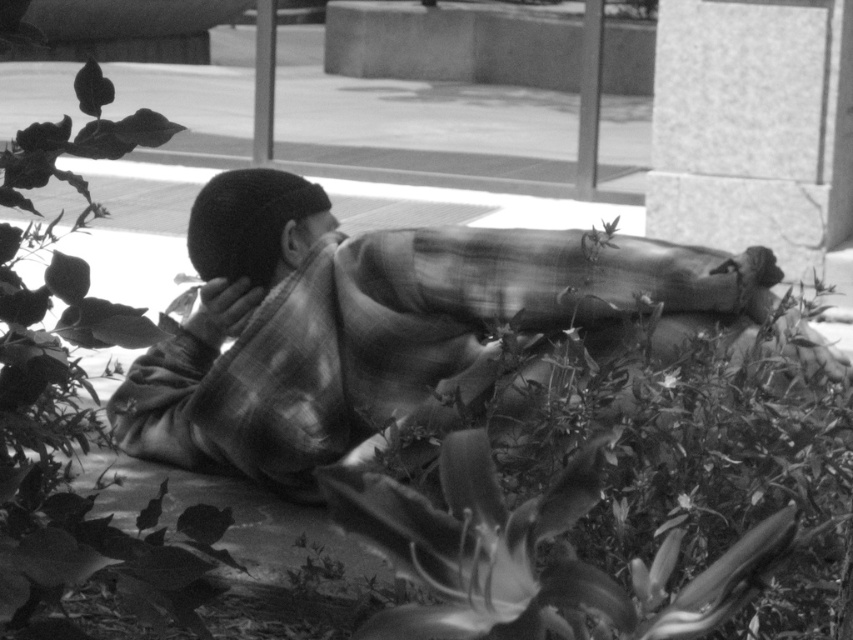
Question: Which point is farther to the camera?

Choices:
 (A) green leafy plant at center
 (B) plaid fabric at center

Answer: (B)

Question: Which point appears farthest from the camera in this image?

Choices:
 (A) (486, 452)
 (B) (292, 244)

Answer: (B)

Question: Among these points, which one is farthest from the camera?

Choices:
 (A) (332, 220)
 (B) (260, 365)
 (C) (404, 524)

Answer: (A)

Question: Is green leafy plant at center smaller than smooth skin face at center?

Choices:
 (A) no
 (B) yes

Answer: (A)

Question: Does green leafy plant at center appear on the left side of smooth skin face at center?

Choices:
 (A) yes
 (B) no

Answer: (B)

Question: Is plaid fabric at center smaller than smooth skin face at center?

Choices:
 (A) yes
 (B) no

Answer: (B)